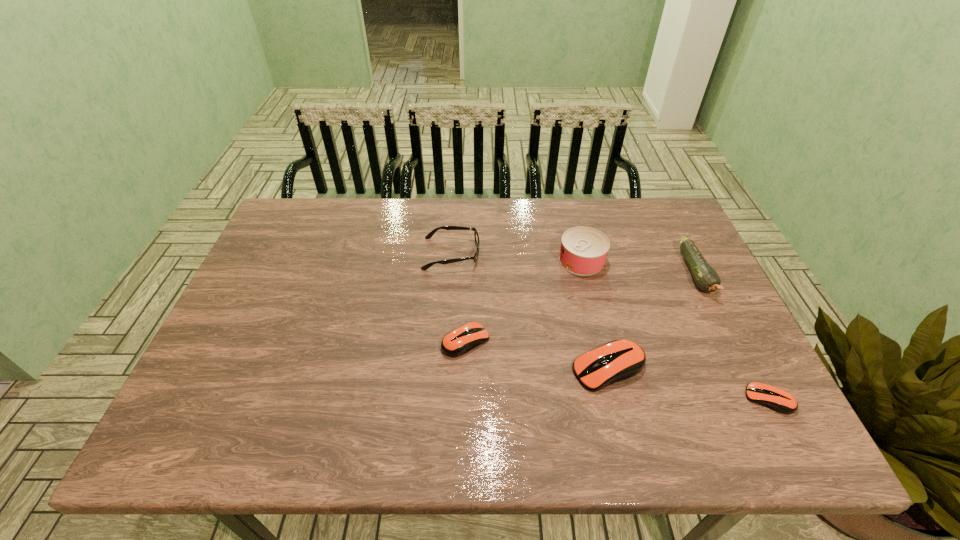
The width and height of the screenshot is (960, 540). Find the location of `the fifth tallest object`. the fifth tallest object is located at coordinates (461, 340).

Where is `the leftmost computer mouse`? Image resolution: width=960 pixels, height=540 pixels. the leftmost computer mouse is located at coordinates (461, 340).

You are a GUI agent. You are given a task and a screenshot of the screen. Output one action in this format:
    pyautogui.click(x=<x>, y=<y>)
    Task: Click on the second computer mouse from left to right
    This screenshot has width=960, height=540.
    Given the screenshot: What is the action you would take?
    pyautogui.click(x=617, y=360)

The height and width of the screenshot is (540, 960). I want to click on the rightmost computer mouse, so click(x=776, y=399).

The width and height of the screenshot is (960, 540). Find the location of `the shortest object`. the shortest object is located at coordinates (776, 399).

The image size is (960, 540). Identify the location of the second tallest object. (706, 278).

The image size is (960, 540). What are the coordinates of `spectacles` in the screenshot? It's located at (476, 236).

You are a GUI agent. You are given a task and a screenshot of the screen. Output one action in this format:
    pyautogui.click(x=<x>, y=<y>)
    Task: Click on the can
    The width and height of the screenshot is (960, 540).
    Given the screenshot: What is the action you would take?
    pyautogui.click(x=583, y=251)

Locate an element on the screen. The height and width of the screenshot is (540, 960). vacant space located 0.400m on the right of the second tallest computer mouse is located at coordinates click(x=652, y=341).

Find the location of a particular element. The image size is (960, 540). vacant region located 0.360m on the left of the second computer mouse from right to left is located at coordinates (418, 369).